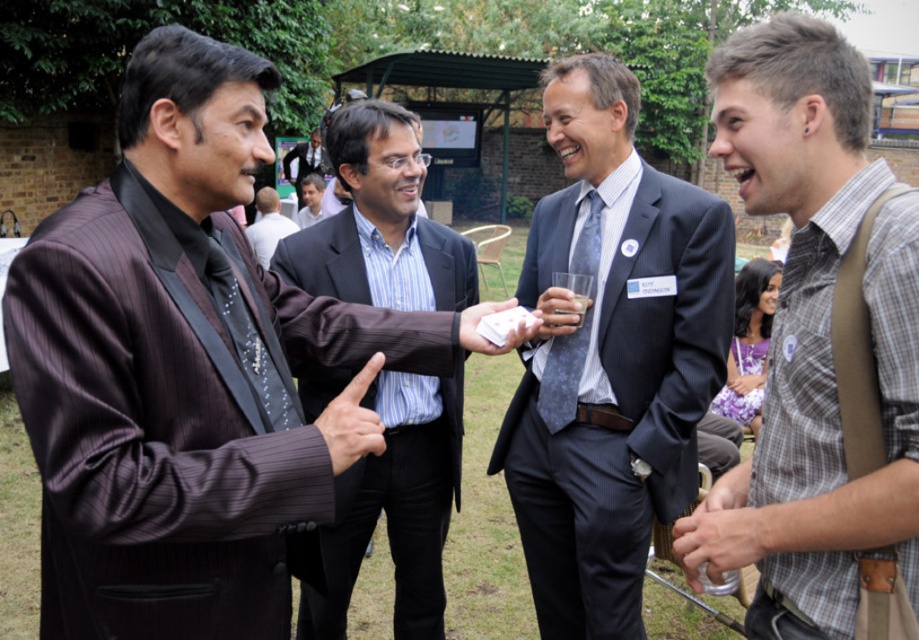
Is checkered shirt at center wider than translucent glass cup at center?

Correct, the width of checkered shirt at center exceeds that of translucent glass cup at center.

Locate an element on the screen. This screenshot has height=640, width=919. checkered shirt at center is located at coordinates (813, 337).

Who is more distant from viewer, (793, 138) or (557, 310)?

The point (557, 310) is more distant.

Where is `checkered shirt at center`? Image resolution: width=919 pixels, height=640 pixels. checkered shirt at center is located at coordinates (813, 337).

Is blue textured tie at center wider than translucent glass cup at center?

Yes, blue textured tie at center is wider than translucent glass cup at center.

The image size is (919, 640). What do you see at coordinates (575, 326) in the screenshot? I see `blue textured tie at center` at bounding box center [575, 326].

The height and width of the screenshot is (640, 919). What are the coordinates of `blue textured tie at center` in the screenshot? It's located at (575, 326).

Is dark blue suit at center positioned in front of striped suit at center?

That is True.

Where is `dark blue suit at center`? dark blue suit at center is located at coordinates (611, 356).